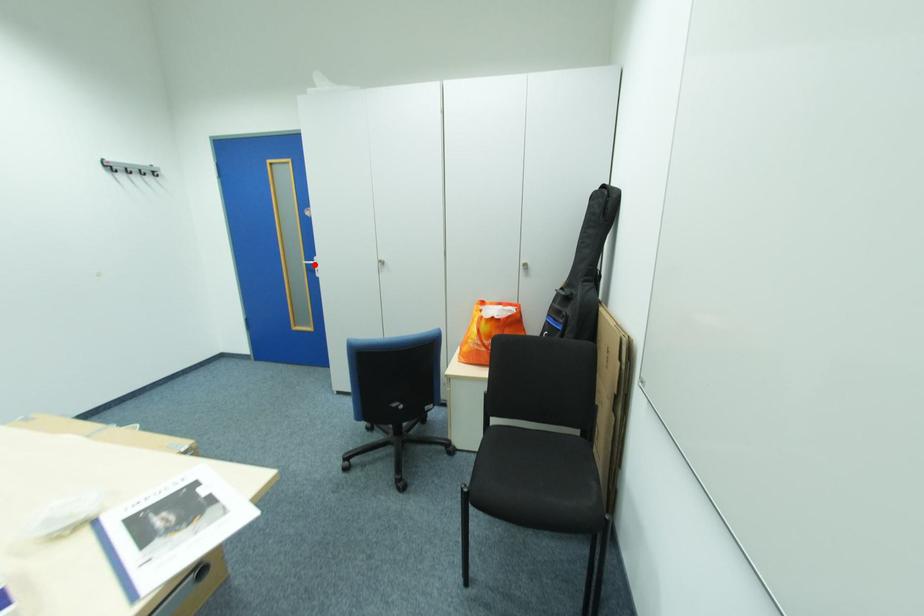
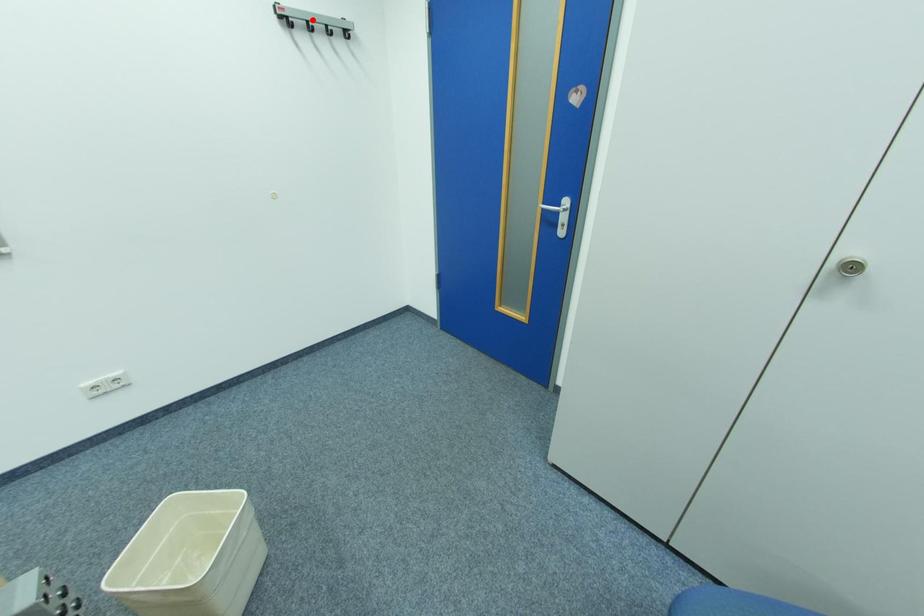
I am providing you with two images of the same scene from different viewpoints. A red point is marked on the first image and another point is marked on the second image. Is the red point in image1 aligned with the point shown in image2?

No